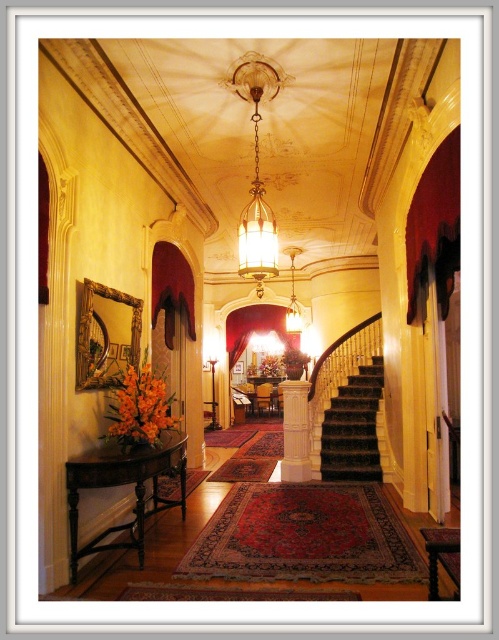
You are standing in the hallway and want to walk up the dark brown carpeted stairs at center. Will the translucent glass chandelier at center be in your way as you climb the stairs?

The dark brown carpeted stairs at center is positioned under the translucent glass chandelier at center, so the chandelier will not be in your way as you climb the stairs because it is above them.

You are standing at the entrance of the hallway and want to know which object is taller between the dark brown carpeted stairs at center and the translucent glass chandelier at center. Can you tell me?

The dark brown carpeted stairs at center is taller than the translucent glass chandelier at center according to the description.